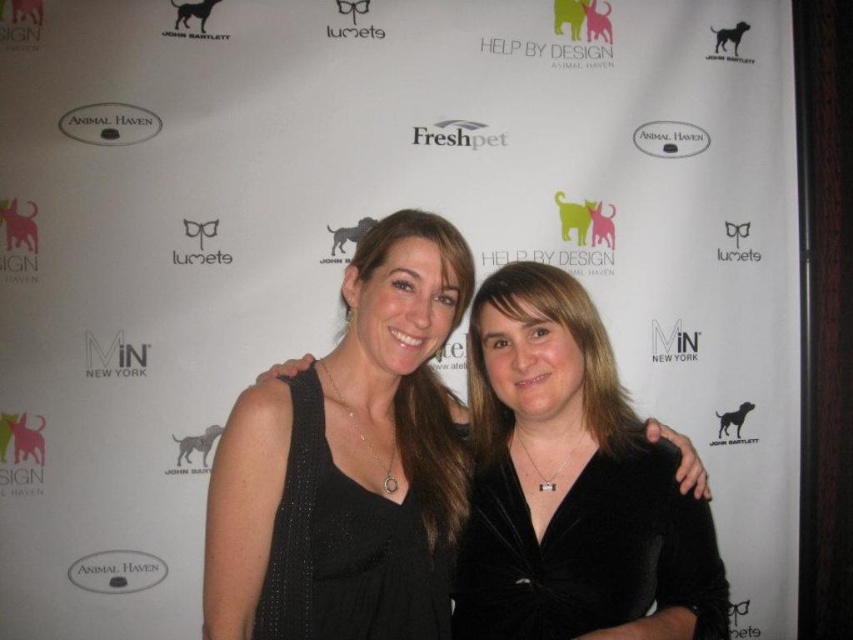
Question: Which point is closer to the camera?

Choices:
 (A) (457, 593)
 (B) (317, 588)
 (C) (363, 513)

Answer: (B)

Question: Can you confirm if velvet black dress at center is bigger than black textured dress at center?

Choices:
 (A) no
 (B) yes

Answer: (A)

Question: Does black velvet dress at center have a lesser width compared to black textured dress at center?

Choices:
 (A) yes
 (B) no

Answer: (B)

Question: Which object is the farthest from the black velvet dress at center?

Choices:
 (A) velvet black dress at center
 (B) black textured dress at center

Answer: (A)

Question: Which point is closer to the camera?

Choices:
 (A) velvet black dress at center
 (B) black velvet dress at center

Answer: (B)

Question: Is velvet black dress at center to the right of black textured dress at center from the viewer's perspective?

Choices:
 (A) no
 (B) yes

Answer: (B)